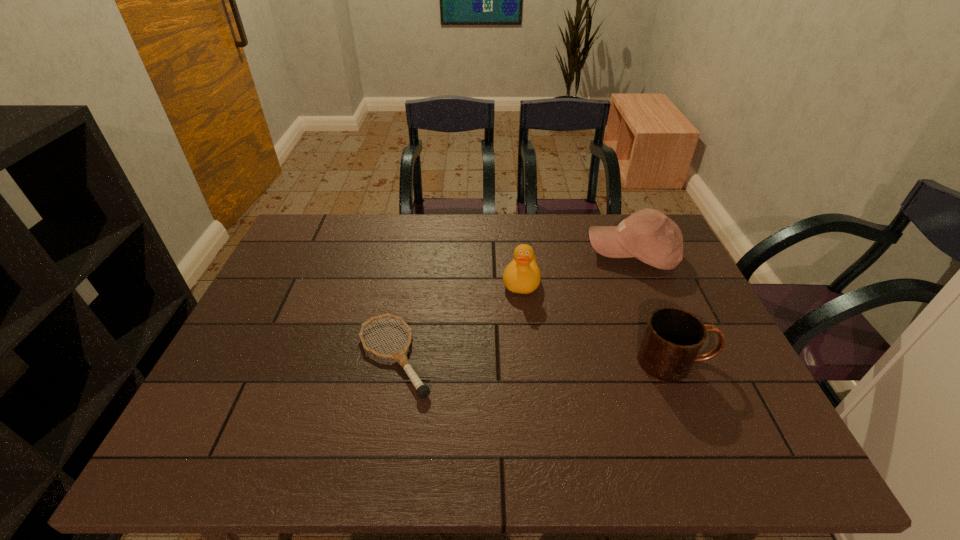
Where is `free space on the desktop that is between the shortest object and the mug and is positioned on the front-facing side of the baseball cap`? The image size is (960, 540). free space on the desktop that is between the shortest object and the mug and is positioned on the front-facing side of the baseball cap is located at coordinates (500, 358).

Identify the location of vacant space on the desktop that is between the shortest object and the mug and is positioned on the face of the second object from left to right. Image resolution: width=960 pixels, height=540 pixels. coord(507,358).